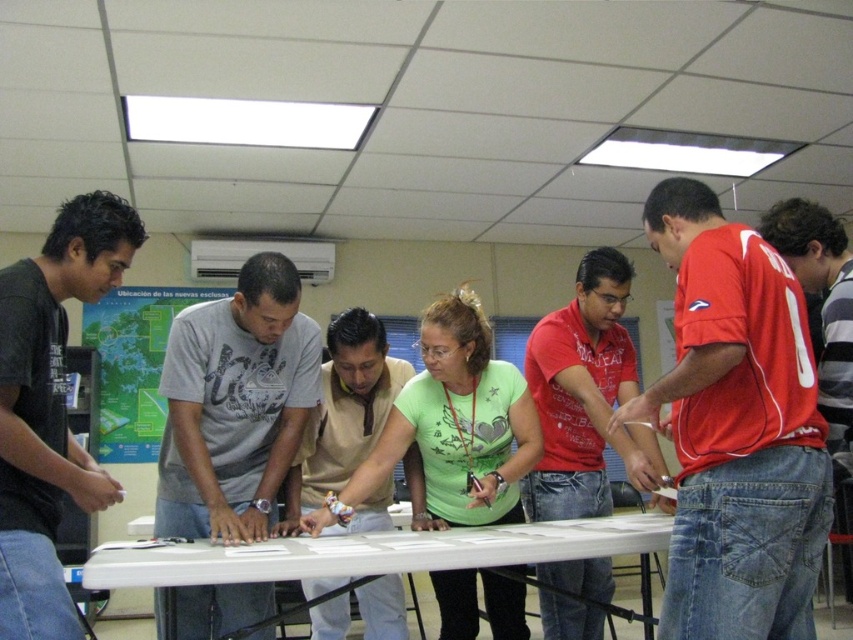
Question: Considering the relative positions of gray cotton t-shirt at center and matte red shirt at center in the image provided, where is gray cotton t-shirt at center located with respect to matte red shirt at center?

Choices:
 (A) above
 (B) below

Answer: (A)

Question: Can you confirm if red jersey at center is positioned below white plastic table at center?

Choices:
 (A) yes
 (B) no

Answer: (B)

Question: Estimate the real-world distances between objects in this image. Which object is closer to the red jersey at center?

Choices:
 (A) gray cotton t-shirt at center
 (B) dark gray t-shirt at left

Answer: (A)

Question: Which point appears closest to the camera in this image?

Choices:
 (A) (265, 257)
 (B) (13, 582)
 (C) (767, 584)
 (D) (503, 404)

Answer: (B)

Question: Which of the following is the closest to the observer?

Choices:
 (A) red jersey at center
 (B) beige cotton shirt at center
 (C) gray cotton t-shirt at center

Answer: (A)

Question: Can you confirm if gray cotton t-shirt at center is smaller than beige cotton shirt at center?

Choices:
 (A) no
 (B) yes

Answer: (B)